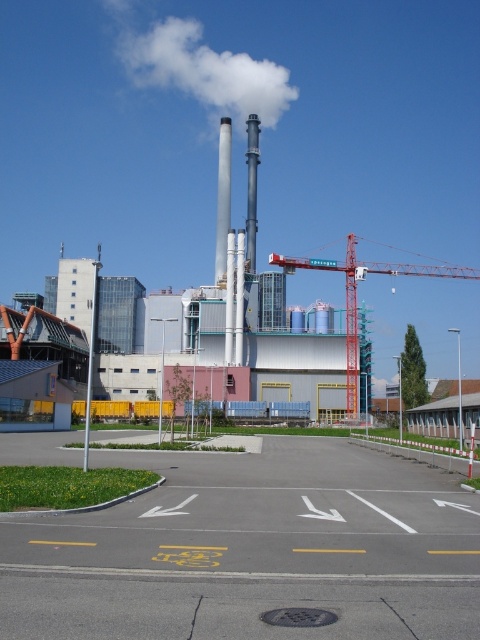
From the picture: You are a delivery person trying to park your bicycle in the parking area. You notice the white smooth chimney at center and the green plastic pole at center in your line of sight. Which object appears wider from your current position?

The white smooth chimney at center might be wider than green plastic pole at center, so it likely appears wider from your current position.

You are standing at the entrance of the industrial facility. You need to locate the white smooth chimney at center. According to the coordinates given, in which direction should you look to find it?

The white smooth chimney at center is located at coordinates point (x=223, y=196). Since the coordinates are in the center area, you should look straight ahead to find it.